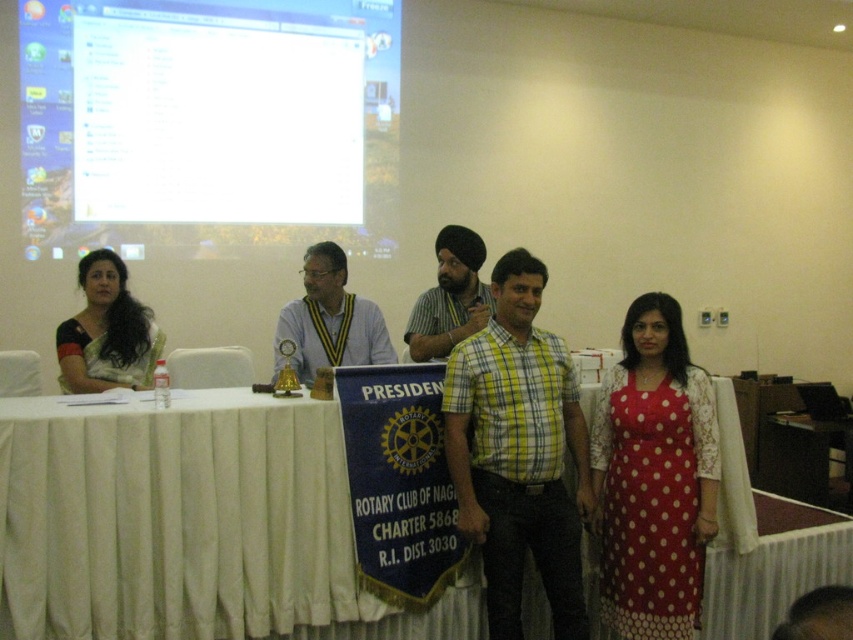
You are attending the Rotary Club meeting and notice the white glossy screen at upper left and the matte yellow and black striped tie at center. Which object is closer to the front of the scene?

The matte yellow and black striped tie at center is behind the white glossy screen at upper left, so the white glossy screen at upper left is closer to the front.

You are organizing a presentation and need to decide where to place a projector. The projector can only project onto surfaces wider than the matte yellow and black striped tie at center. Based on the scene, is the white glossy screen at upper left a suitable surface for the projector?

The white glossy screen at upper left might be wider than the matte yellow and black striped tie at center, so it could be a suitable surface for the projector if its width meets the projector requirement.